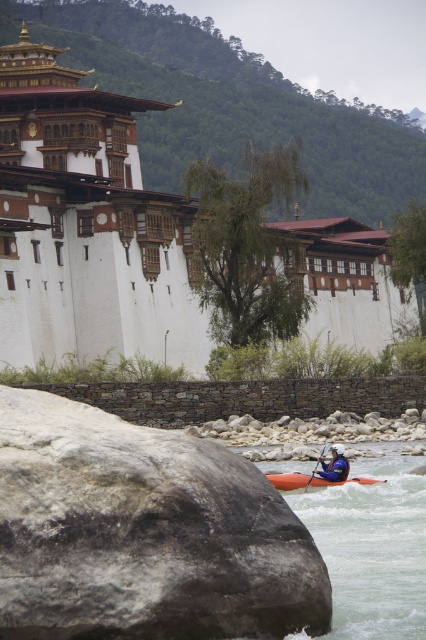
You are a photographer standing at the riverside and want to capture both the rough gray rock at lower left and the orange matte kayak at lower center in the same frame. Which object should you position closer to the top of your camera viewfinder?

The rough gray rock at lower left should be positioned closer to the top of the camera viewfinder because it is located above the orange matte kayak at lower center in the scene.

You are standing at the riverside and see the rough gray rock at lower left and the orange plastic paddle at lower center. Which object is closer to your left side?

The rough gray rock at lower left is positioned on the left side of orange plastic paddle at lower center, so it is closer to your left side.

You are standing at the riverside and want to take a photo of the orange matte kayak at lower center. There is a rough gray rock at lower left in the way. Can you move the rock to get a clear shot of the kayak?

The rough gray rock at lower left is closer to the viewer than the orange matte kayak at lower center. To get a clear shot of the orange matte kayak at lower center, you would need to move the rough gray rock at lower left out of the way since it is blocking the view.